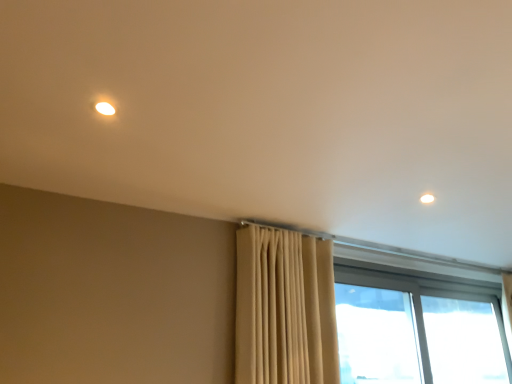
Identify the location of beige fabric curtain at center. The width and height of the screenshot is (512, 384). (285, 308).

Is beige fabric curtain at center positioned with its back to transparent glass window at right, the 2th window when ordered from left to right?

No, beige fabric curtain at center's orientation is not away from transparent glass window at right, the 2th window when ordered from left to right.

Is beige fabric curtain at center in front of or behind transparent glass window at right, the 2th window when ordered from left to right, in the image?

beige fabric curtain at center is positioned closer to the viewer than transparent glass window at right, the 2th window when ordered from left to right.

Measure the distance from beige fabric curtain at center to transparent glass window at right, the first window when ordered from right to left.

A distance of 2.15 meters exists between beige fabric curtain at center and transparent glass window at right, the first window when ordered from right to left.

Are beige fabric curtain at center and transparent glass window at right, the 2th window when ordered from left to right, located far from each other?

beige fabric curtain at center is far away from transparent glass window at right, the 2th window when ordered from left to right.

How many degrees apart are the facing directions of transparent glass window at right, the 2th window when ordered from left to right, and transparent glass window at lower right, marked as the first window in a left-to-right arrangement?

The angle between the facing direction of transparent glass window at right, the 2th window when ordered from left to right, and the facing direction of transparent glass window at lower right, marked as the first window in a left-to-right arrangement, is 0.604 degrees.

Consider the image. Considering the relative positions of transparent glass window at right, the first window when ordered from right to left, and transparent glass window at lower right, which is counted as the second window, starting from the right, in the image provided, is transparent glass window at right, the first window when ordered from right to left, to the left of transparent glass window at lower right, which is counted as the second window, starting from the right, from the viewer's perspective?

In fact, transparent glass window at right, the first window when ordered from right to left, is to the right of transparent glass window at lower right, which is counted as the second window, starting from the right.

Is transparent glass window at right, the 2th window when ordered from left to right, looking in the opposite direction of transparent glass window at lower right, marked as the first window in a left-to-right arrangement?

That's right, transparent glass window at right, the 2th window when ordered from left to right, is facing away from transparent glass window at lower right, marked as the first window in a left-to-right arrangement.

Is transparent glass window at right, the 2th window when ordered from left to right, not close to transparent glass window at lower right, which is counted as the second window, starting from the right?

No.

Considering the positions of objects beige fabric curtain at center and transparent glass window at lower right, which is counted as the second window, starting from the right, in the image provided, who is more to the right, beige fabric curtain at center or transparent glass window at lower right, which is counted as the second window, starting from the right,?

transparent glass window at lower right, which is counted as the second window, starting from the right, is more to the right.

Which is behind, point (242, 364) or point (495, 378)?

The point (495, 378) is farther.

Which is behind, beige fabric curtain at center or transparent glass window at lower right, marked as the first window in a left-to-right arrangement?

transparent glass window at lower right, marked as the first window in a left-to-right arrangement, is behind.

Can we say beige fabric curtain at center lies outside transparent glass window at lower right, marked as the first window in a left-to-right arrangement?

That's correct, beige fabric curtain at center is outside of transparent glass window at lower right, marked as the first window in a left-to-right arrangement.

From the image's perspective, who appears lower, transparent glass window at right, the 2th window when ordered from left to right, or beige fabric curtain at center?

From the image's view, transparent glass window at right, the 2th window when ordered from left to right, is below.

Is transparent glass window at right, the first window when ordered from right to left, not near beige fabric curtain at center?

Yes, transparent glass window at right, the first window when ordered from right to left, and beige fabric curtain at center are located far from each other.

Is transparent glass window at right, the 2th window when ordered from left to right, surrounding beige fabric curtain at center?

No, transparent glass window at right, the 2th window when ordered from left to right, does not contain beige fabric curtain at center.

In terms of height, does transparent glass window at right, the first window when ordered from right to left, look taller or shorter compared to beige fabric curtain at center?

transparent glass window at right, the first window when ordered from right to left, is shorter than beige fabric curtain at center.

From a real-world perspective, is transparent glass window at lower right, which is counted as the second window, starting from the right, above or below beige fabric curtain at center?

transparent glass window at lower right, which is counted as the second window, starting from the right, is situated lower than beige fabric curtain at center in the real world.

Between transparent glass window at lower right, which is counted as the second window, starting from the right, and beige fabric curtain at center, which one appears on the left side from the viewer's perspective?

Positioned to the left is beige fabric curtain at center.

Considering the relative sizes of transparent glass window at lower right, marked as the first window in a left-to-right arrangement, and beige fabric curtain at center in the image provided, is transparent glass window at lower right, marked as the first window in a left-to-right arrangement, smaller than beige fabric curtain at center?

Indeed, transparent glass window at lower right, marked as the first window in a left-to-right arrangement, has a smaller size compared to beige fabric curtain at center.

Starting from the beige fabric curtain at center, which window is the 1st one to the right? Please provide its 2D coordinates.

[(417, 330)]

From the image's perspective, is transparent glass window at lower right, marked as the first window in a left-to-right arrangement, on transparent glass window at right, the first window when ordered from right to left?

Yes, from the image's perspective, transparent glass window at lower right, marked as the first window in a left-to-right arrangement, is on top of transparent glass window at right, the first window when ordered from right to left.

Consider the image. Does transparent glass window at lower right, which is counted as the second window, starting from the right, have a lesser width compared to transparent glass window at right, the 2th window when ordered from left to right?

Yes.

From a real-world perspective, is transparent glass window at lower right, which is counted as the second window, starting from the right, physically located above or below transparent glass window at right, the 2th window when ordered from left to right?

Clearly, from a real-world perspective, transparent glass window at lower right, which is counted as the second window, starting from the right, is below transparent glass window at right, the 2th window when ordered from left to right.

There is a transparent glass window at right, the first window when ordered from right to left. What are the coordinates of `curtain above it (from a real-world perspective)` in the screenshot? It's located at pos(285,308).

The width and height of the screenshot is (512, 384). In order to click on window that is below the transparent glass window at lower right, marked as the first window in a left-to-right arrangement (from the image's perspective) in this screenshot , I will do `click(465, 341)`.

Looking at the image, which one is located further to transparent glass window at lower right, marked as the first window in a left-to-right arrangement, beige fabric curtain at center or transparent glass window at right, the 2th window when ordered from left to right?

beige fabric curtain at center is further to transparent glass window at lower right, marked as the first window in a left-to-right arrangement.

From the image, which object appears to be farther from transparent glass window at right, the 2th window when ordered from left to right, transparent glass window at lower right, which is counted as the second window, starting from the right, or beige fabric curtain at center?

The object further to transparent glass window at right, the 2th window when ordered from left to right, is beige fabric curtain at center.

Looking at the image, which one is located further to beige fabric curtain at center, transparent glass window at right, the 2th window when ordered from left to right, or transparent glass window at lower right, which is counted as the second window, starting from the right?

transparent glass window at right, the 2th window when ordered from left to right, is positioned further to the anchor beige fabric curtain at center.

Estimate the real-world distances between objects in this image. Which object is closer to transparent glass window at right, the 2th window when ordered from left to right, beige fabric curtain at center or transparent glass window at lower right, marked as the first window in a left-to-right arrangement?

transparent glass window at lower right, marked as the first window in a left-to-right arrangement, is closer to transparent glass window at right, the 2th window when ordered from left to right.

Looking at the image, which one is located closer to transparent glass window at lower right, which is counted as the second window, starting from the right, transparent glass window at right, the 2th window when ordered from left to right, or beige fabric curtain at center?

transparent glass window at right, the 2th window when ordered from left to right, lies closer to transparent glass window at lower right, which is counted as the second window, starting from the right, than the other object.

Considering their positions, is transparent glass window at lower right, which is counted as the second window, starting from the right, positioned further to beige fabric curtain at center than transparent glass window at right, the 2th window when ordered from left to right?

transparent glass window at right, the 2th window when ordered from left to right, is further to beige fabric curtain at center.

Locate an element on the screen. window between beige fabric curtain at center and transparent glass window at right, the 2th window when ordered from left to right is located at coordinates (417, 330).